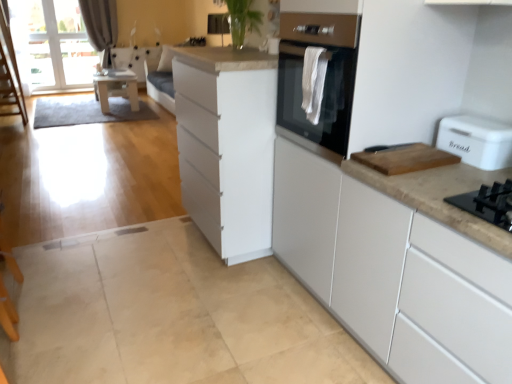
Question: Is point (53, 86) closer or farther from the camera than point (364, 163)?

Choices:
 (A) farther
 (B) closer

Answer: (A)

Question: Considering the positions of transparent glass window screen at upper left and wooden cutting board at right in the image, is transparent glass window screen at upper left bigger or smaller than wooden cutting board at right?

Choices:
 (A) big
 (B) small

Answer: (A)

Question: Considering the real-world distances, which object is closest to the wooden cutting board at right?

Choices:
 (A) white plastic bread bin at right
 (B) wooden table at left
 (C) gray fabric curtain at upper left
 (D) white matte cabinet at center, the 2th cabinetry in the left-to-right sequence
 (E) white matte cabinet at center, marked as the 2th cabinetry in a right-to-left arrangement

Answer: (A)

Question: Which object is the closest to the white plastic bread bin at right?

Choices:
 (A) wooden cutting board at right
 (B) wooden table at left
 (C) white matte cabinet at center, which is counted as the 1th cabinetry, starting from the right
 (D) transparent glass window screen at upper left
 (E) gray fabric curtain at upper left

Answer: (A)